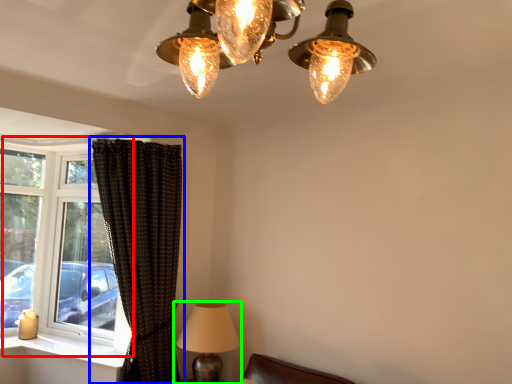
Question: Which object is positioned farthest from window (highlighted by a red box)? Select from curtain (highlighted by a blue box) and lamp (highlighted by a green box).

Choices:
 (A) curtain
 (B) lamp

Answer: (B)